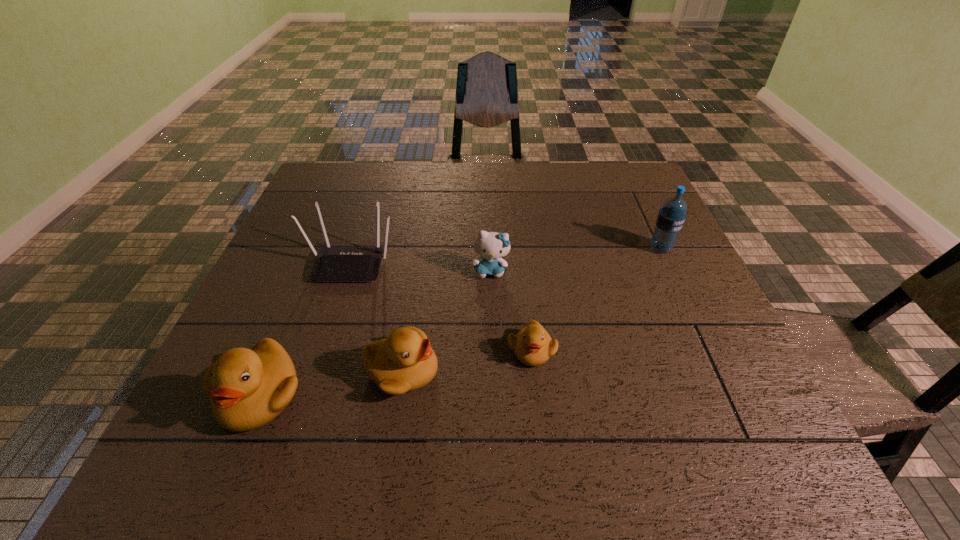
This screenshot has width=960, height=540. Identify the location of vacant area located 0.140m on the face of the kitten. (492, 326).

This screenshot has width=960, height=540. Identify the location of vacant position located 0.200m on the left of the water bottle. (571, 248).

Locate an element on the screen. The image size is (960, 540). vacant area situated 0.120m on the front-facing side of the router is located at coordinates (331, 323).

The height and width of the screenshot is (540, 960). In order to click on duckling at the left edge in this screenshot , I will do `click(248, 388)`.

The image size is (960, 540). In order to click on router that is positioned at the left edge in this screenshot , I will do `click(333, 264)`.

Locate an element on the screen. Image resolution: width=960 pixels, height=540 pixels. object that is at the right edge is located at coordinates (670, 219).

Where is `object located in the near left corner section of the desktop`? This screenshot has width=960, height=540. object located in the near left corner section of the desktop is located at coordinates (248, 388).

Where is `vacant space at the far edge of the desktop`? vacant space at the far edge of the desktop is located at coordinates (393, 188).

In order to click on blank area at the near edge in this screenshot , I will do `click(365, 395)`.

At what (x,y) coordinates should I click in order to perform the action: click on vacant space at the left edge of the desktop. Please return your answer as a coordinate pair (x, y). The image size is (960, 540). Looking at the image, I should click on (311, 224).